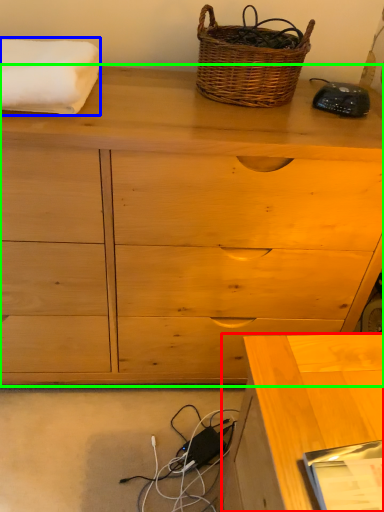
Question: Estimate the real-world distances between objects in this image. Which object is farther from desk (highlighted by a red box), bath towel (highlighted by a blue box) or chest of drawers (highlighted by a green box)?

Choices:
 (A) bath towel
 (B) chest of drawers

Answer: (A)